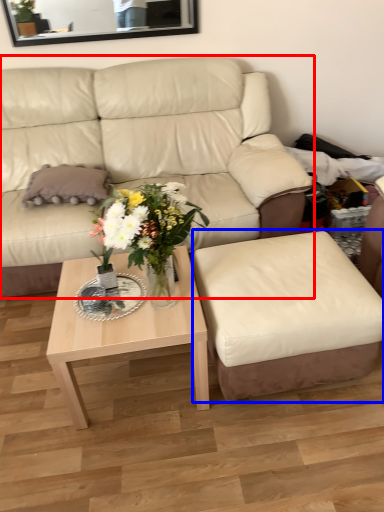
Question: Which of the following is the closest to the observer, studio couch (highlighted by a red box) or swivel chair (highlighted by a blue box)?

Choices:
 (A) studio couch
 (B) swivel chair

Answer: (B)